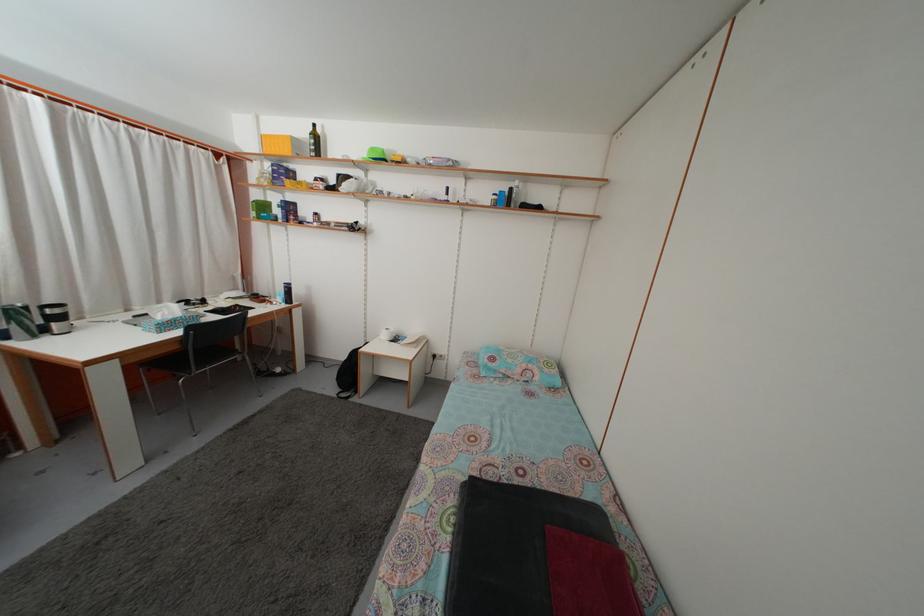
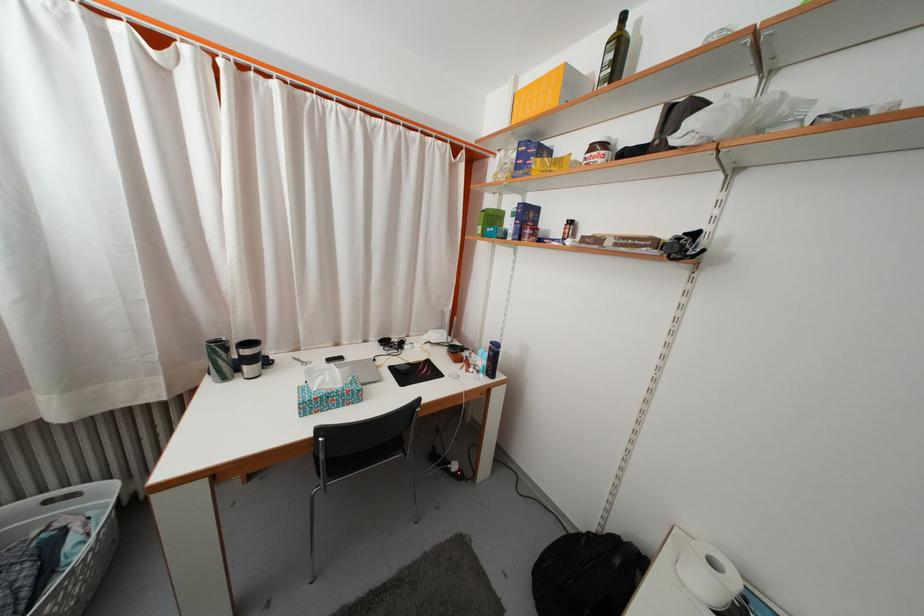
Where in the second image is the point corresponding to (x=214, y=315) from the first image?

(402, 369)